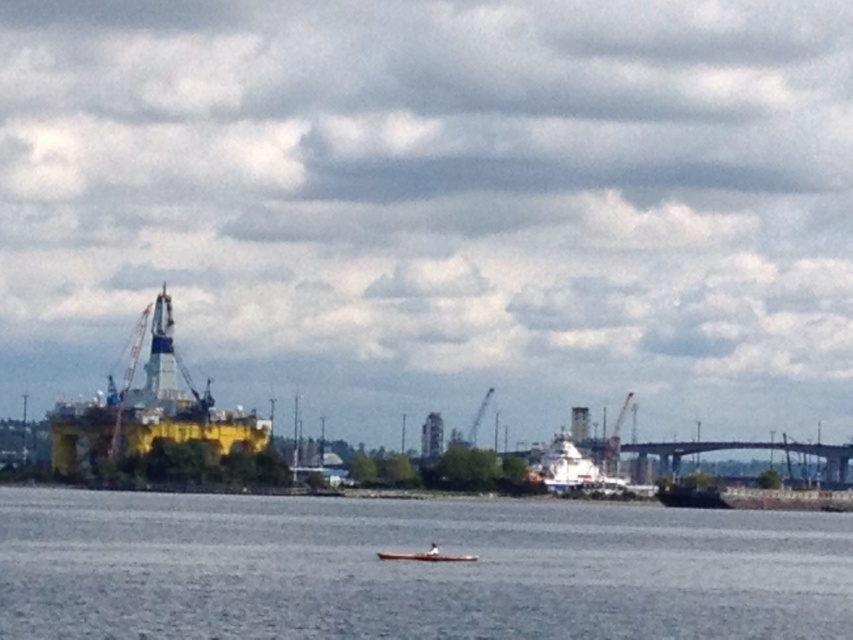
Does point (421, 502) come behind point (611, 435)?

No.

Does point (614, 552) lie in front of point (618, 422)?

That is True.

Locate an element on the screen. This screenshot has width=853, height=640. gray water at center is located at coordinates (410, 570).

Where is `yellow matte oil rig at left`? yellow matte oil rig at left is located at coordinates (149, 406).

Can you confirm if yellow matte oil rig at left is smaller than wooden canoe at center?

No.

Which is in front, point (120, 396) or point (474, 556)?

Point (474, 556) is in front.

Identify the location of yellow matte oil rig at left. (149, 406).

In the scene shown: Who is shorter, gray water at center or yellow matte oil rig at left?

With less height is gray water at center.

Which of these two, gray water at center or yellow matte oil rig at left, stands taller?

yellow matte oil rig at left

Which is behind, point (735, 595) or point (91, 426)?

Positioned behind is point (91, 426).

Image resolution: width=853 pixels, height=640 pixels. I want to click on gray water at center, so click(x=410, y=570).